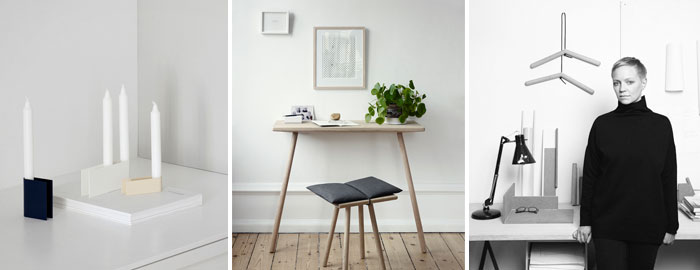
What are the coordinates of `candle` in the screenshot? It's located at (24, 130), (97, 132), (162, 146), (120, 109).